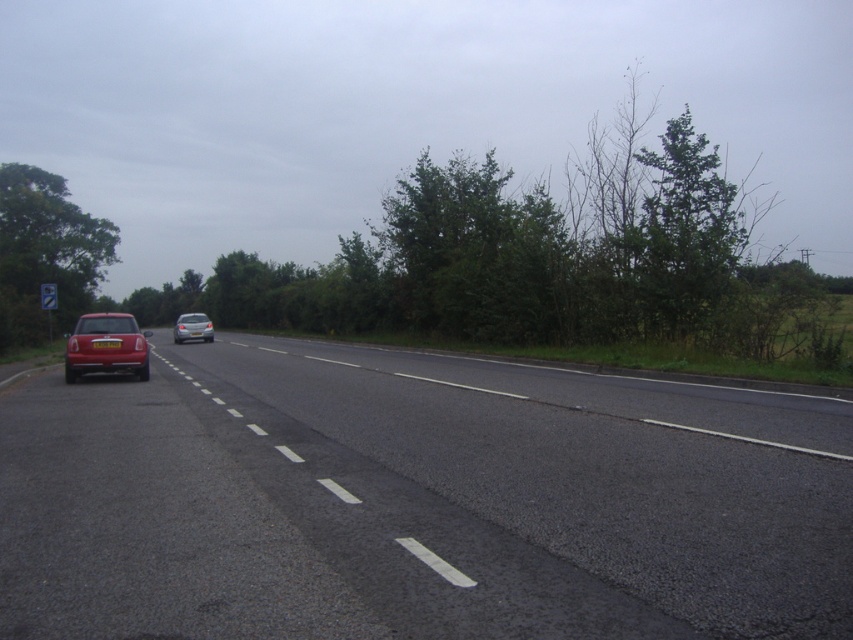
Question: Which object appears closest to the camera in this image?

Choices:
 (A) yellow matte license plate at center
 (B) shiny red car at left

Answer: (B)

Question: Can you confirm if shiny red car at left is positioned to the left of satin silver car at center?

Choices:
 (A) yes
 (B) no

Answer: (B)

Question: Which point is farther from the camera taking this photo?

Choices:
 (A) (102, 340)
 (B) (693, 198)

Answer: (B)

Question: Can you confirm if green leafy tree at upper right is bigger than shiny red car at left?

Choices:
 (A) no
 (B) yes

Answer: (B)

Question: Considering the real-world distances, which object is farthest from the smooth asphalt road at center?

Choices:
 (A) satin silver car at center
 (B) white plastic license plate at center

Answer: (A)

Question: Does green leafy tree at upper right appear on the left side of white plastic license plate at center?

Choices:
 (A) no
 (B) yes

Answer: (A)